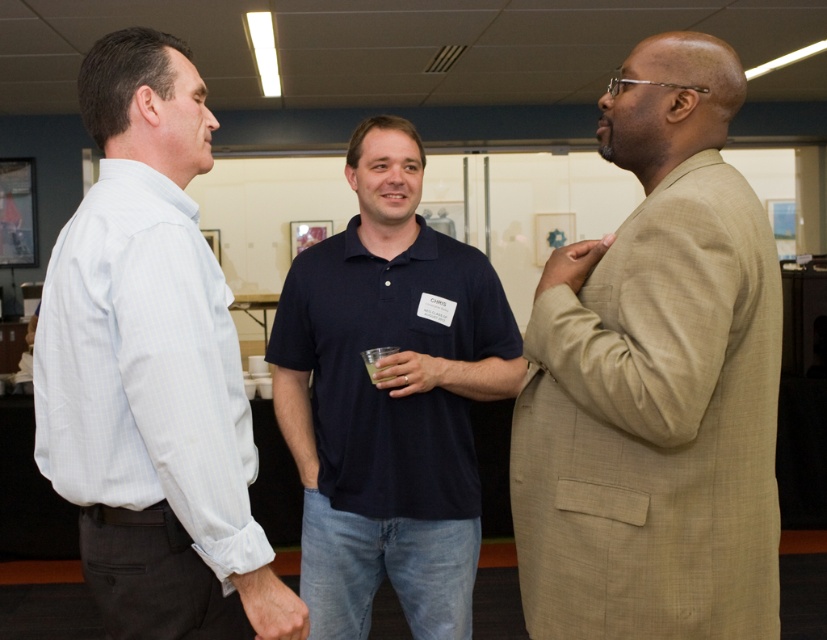
Based on the photo, does light blue striped shirt at left lie in front of dark blue cotton polo shirt at center?

Yes, light blue striped shirt at left is in front of dark blue cotton polo shirt at center.

The width and height of the screenshot is (827, 640). What are the coordinates of `light blue striped shirt at left` in the screenshot? It's located at (151, 371).

Does point (175, 246) come in front of point (307, 384)?

Yes.

Where is `light blue striped shirt at left`? The height and width of the screenshot is (640, 827). light blue striped shirt at left is located at coordinates (151, 371).

Which is in front, point (410, 124) or point (394, 349)?

Point (394, 349)

The image size is (827, 640). I want to click on dark blue cotton polo shirt at center, so click(390, 397).

Between tan textured suit at right and dark blue cotton polo shirt at center, which one is positioned higher?

tan textured suit at right

Is tan textured suit at right positioned before dark blue cotton polo shirt at center?

That is True.

This screenshot has width=827, height=640. Describe the element at coordinates (655, 381) in the screenshot. I see `tan textured suit at right` at that location.

Where is `tan textured suit at right`? The image size is (827, 640). tan textured suit at right is located at coordinates (655, 381).